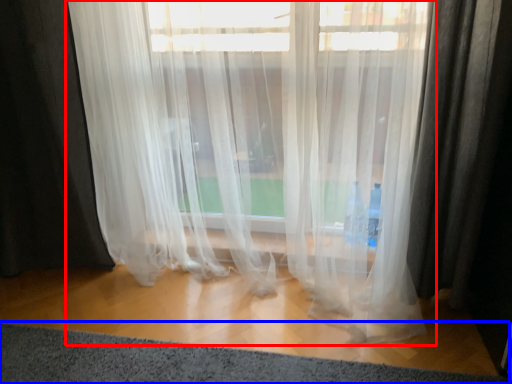
Question: Which object is closer to the camera taking this photo, curtain (highlighted by a red box) or doormat (highlighted by a blue box)?

Choices:
 (A) curtain
 (B) doormat

Answer: (B)